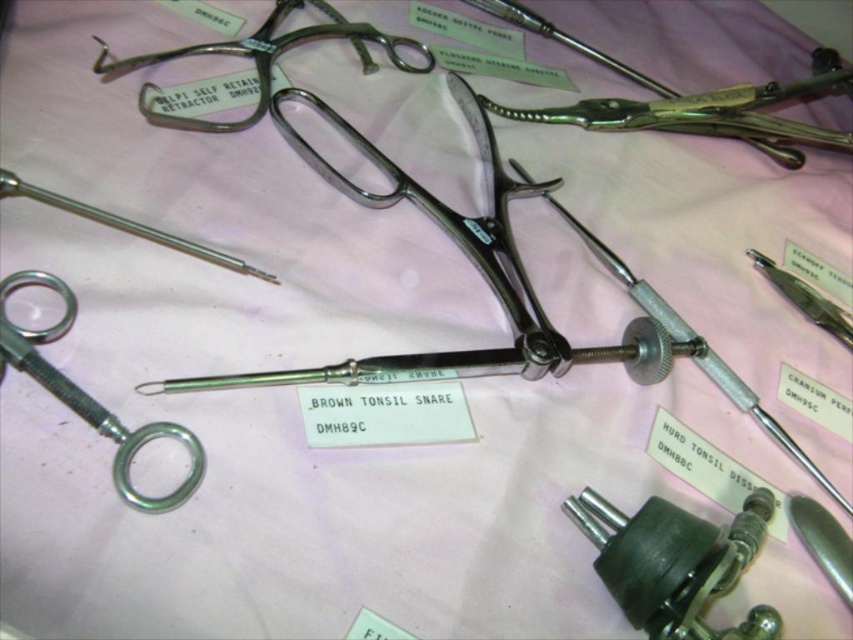
Is metallic silver scissors at upper center wider than polished metal needle at center?

Yes.

Does metallic silver scissors at upper center appear under polished metal needle at center?

Incorrect, metallic silver scissors at upper center is not positioned below polished metal needle at center.

Where is `metallic silver scissors at upper center`? metallic silver scissors at upper center is located at coordinates (263, 60).

Who is shorter, polished metal needle at center or satin silver scalpel at upper right?

polished metal needle at center

Is point (106, 211) closer to camera compared to point (770, 266)?

That is True.

I want to click on polished metal needle at center, so click(x=125, y=225).

Does point (769, 627) come in front of point (403, 36)?

Yes, point (769, 627) is in front of point (403, 36).

Is point (611, 582) closer to viewer compared to point (257, 52)?

Yes, point (611, 582) is closer to viewer.

This screenshot has width=853, height=640. In order to click on metallic silver screw at lower right in this screenshot , I will do (675, 563).